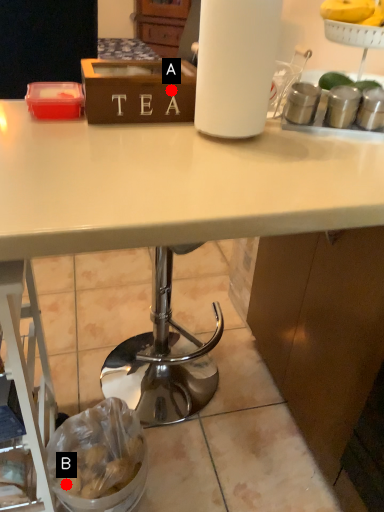
Question: Two points are circled on the image, labeled by A and B beside each circle. Among these points, which one is farthest from the camera?

Choices:
 (A) A is further
 (B) B is further

Answer: (B)